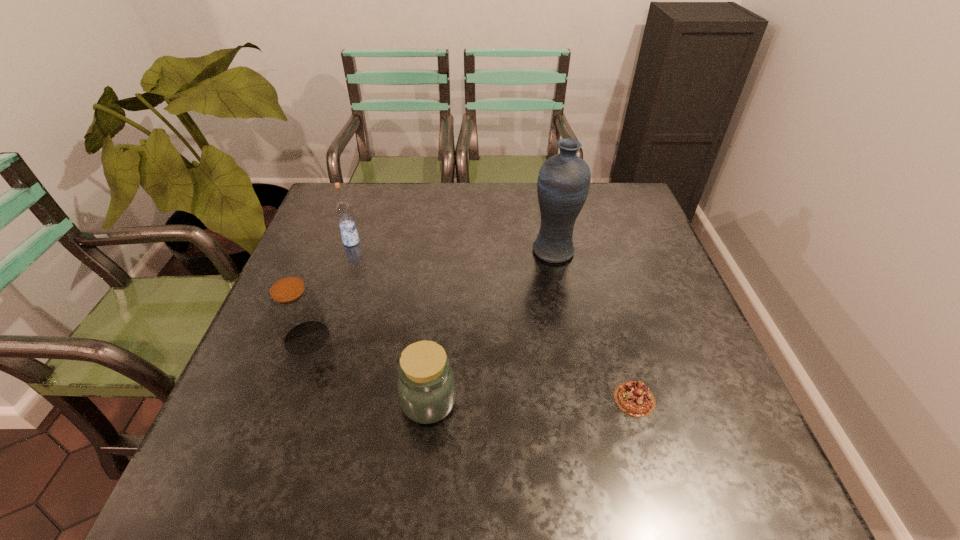
Identify the location of vase. This screenshot has height=540, width=960. (564, 179).

Locate an element on the screen. The height and width of the screenshot is (540, 960). vodka is located at coordinates (343, 210).

Identify the location of the left jar. The width and height of the screenshot is (960, 540). (295, 309).

Locate an element on the screen. the farther jar is located at coordinates (295, 309).

Locate an element on the screen. Image resolution: width=960 pixels, height=540 pixels. the third object from right to left is located at coordinates (426, 387).

At what (x,y) coordinates should I click in order to perform the action: click on the right jar. Please return your answer as a coordinate pair (x, y). Looking at the image, I should click on (426, 387).

Locate an element on the screen. the shortest object is located at coordinates (634, 398).

Image resolution: width=960 pixels, height=540 pixels. In order to click on vacant area situated on the left of the vase in this screenshot , I will do `click(437, 251)`.

At what (x,y) coordinates should I click in order to perform the action: click on vacant space located 0.190m on the back of the second tallest object. Please return your answer as a coordinate pair (x, y). Looking at the image, I should click on (366, 200).

Locate an element on the screen. This screenshot has height=540, width=960. vacant area situated on the front of the third farthest object is located at coordinates (294, 375).